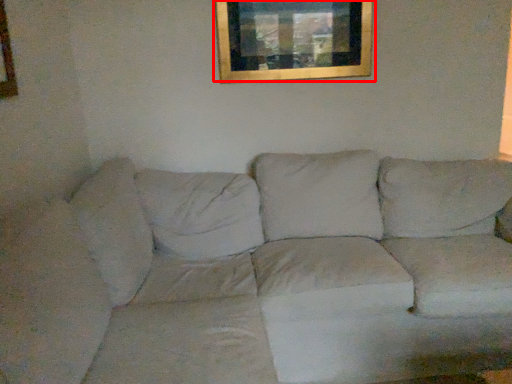
Question: Observing the image, what is the correct spatial positioning of picture frame (annotated by the red box) in reference to studio couch?

Choices:
 (A) left
 (B) right

Answer: (B)